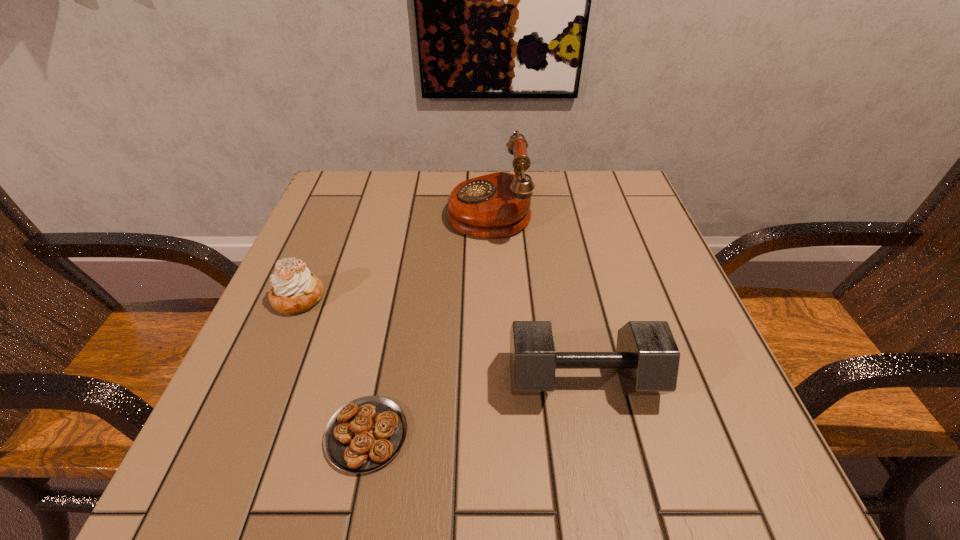
Find the location of `vacant area located 0.260m on the left of the dumbbell`. vacant area located 0.260m on the left of the dumbbell is located at coordinates tap(347, 379).

At what (x,y) coordinates should I click in order to perform the action: click on vacant space located on the back of the third tallest object. Please return your answer as a coordinate pair (x, y). The image size is (960, 540). Looking at the image, I should click on point(323,240).

The width and height of the screenshot is (960, 540). In order to click on vacant point located on the right of the shorter pastry in this screenshot , I will do `click(464, 435)`.

The height and width of the screenshot is (540, 960). I want to click on object that is at the far edge, so click(497, 205).

You are a GUI agent. You are given a task and a screenshot of the screen. Output one action in this format:
    pyautogui.click(x=<x>, y=<y>)
    Task: Click on the object at the near edge
    The width and height of the screenshot is (960, 540).
    Given the screenshot: What is the action you would take?
    pyautogui.click(x=365, y=434)

This screenshot has height=540, width=960. What are the coordinates of `object positioned at the left edge` in the screenshot? It's located at (294, 290).

I want to click on object present at the right edge, so click(x=647, y=358).

Where is `free region at the far edge`? free region at the far edge is located at coordinates (402, 197).

Image resolution: width=960 pixels, height=540 pixels. Find the location of `vacant region at the left edge`. vacant region at the left edge is located at coordinates (330, 320).

The height and width of the screenshot is (540, 960). In the image, there is a desktop. In order to click on blank space at the right edge in this screenshot , I will do `click(709, 341)`.